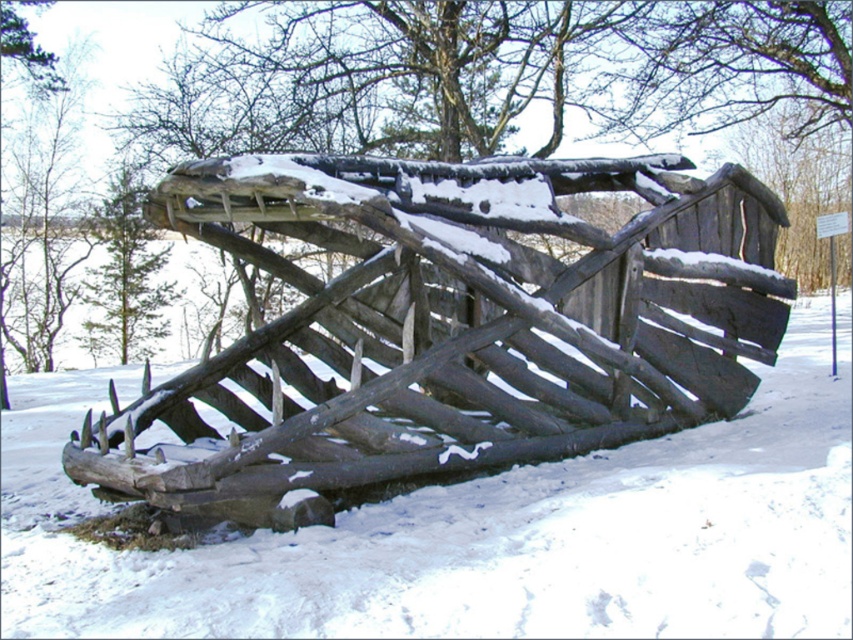
You are an architect designing a winter garden and want to place a rustic wooden fence at center and white matte snow at lower center in your design. Which of the two elements has a narrower width?

The rustic wooden fence at center is thinner than the white matte snow at lower center, so the rustic wooden fence at center has a narrower width.

You are standing in the snowy outdoor area and want to walk to the rustic wooden fence at center. Which direction should you head relative to the white matte snow at lower center?

You should head to the left of the white matte snow at lower center to reach the rustic wooden fence at center since the rustic wooden fence at center is positioned to the left of the white matte snow at lower center.

You are standing in front of the wooden whale structure and want to take a photo. You notice two points marked on the structure at coordinates point [396,269] and point [363,588]. Which point should you focus on first if you want to capture the closest part of the structure to your camera?

You should focus on point [396,269] first because it is closer to the camera compared to point [363,588], as per the description.